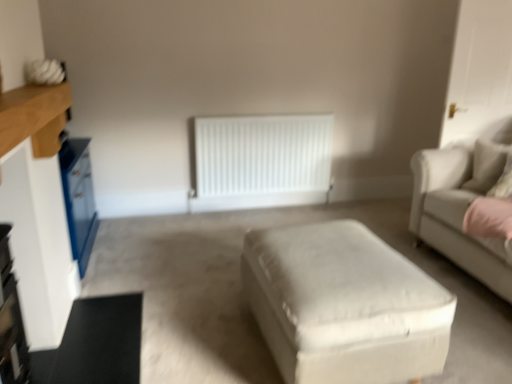
Locate an element on the screen. This screenshot has width=512, height=384. white fabric ottoman at center is located at coordinates 344,305.

What do you see at coordinates (487, 165) in the screenshot? I see `beige fabric pillow at right` at bounding box center [487, 165].

What is the approximate height of beige fabric pillow at right?

The height of beige fabric pillow at right is 20.41 inches.

What is the approximate height of white matte radiator at center?

It is 33.25 inches.

What do you see at coordinates (37, 208) in the screenshot?
I see `white wood entertainment center at left` at bounding box center [37, 208].

This screenshot has width=512, height=384. What are the coordinates of `beige fabric couch at right` in the screenshot? It's located at (462, 204).

In the scene shown: Considering the relative sizes of beige fabric pillow at right and beige fabric couch at right in the image provided, is beige fabric pillow at right bigger than beige fabric couch at right?

Incorrect, beige fabric pillow at right is not larger than beige fabric couch at right.

Which point is more forward, (493, 146) or (464, 145)?

The point (493, 146) is closer to the camera.

From a real-world perspective, is beige fabric pillow at right on beige fabric couch at right?

Yes, from a real-world perspective, beige fabric pillow at right is on top of beige fabric couch at right.

From the image's perspective, would you say beige fabric pillow at right is shown under beige fabric couch at right?

No, from the image's perspective, beige fabric pillow at right is not below beige fabric couch at right.

Which is behind, beige fabric couch at right or white wood entertainment center at left?

Positioned behind is beige fabric couch at right.

Looking at this image, can you confirm if beige fabric couch at right is positioned to the right of white wood entertainment center at left?

Yes.

From the image's perspective, is beige fabric couch at right below white wood entertainment center at left?

Yes, from the image's perspective, beige fabric couch at right is below white wood entertainment center at left.

Are beige fabric couch at right and white wood entertainment center at left far apart?

Yes, beige fabric couch at right is far from white wood entertainment center at left.

Is the surface of beige fabric pillow at right in direct contact with white matte radiator at center?

No, beige fabric pillow at right is not with white matte radiator at center.

Considering the positions of points (480, 157) and (309, 121), is point (480, 157) closer to camera compared to point (309, 121)?

Yes.

Find the location of a particular element. pillow in front of the white matte radiator at center is located at coordinates (487, 165).

Which is more to the left, beige fabric pillow at right or white matte radiator at center?

white matte radiator at center is more to the left.

Does point (474, 183) lie in front of point (205, 125)?

Yes, it is.

From the image's perspective, which object appears higher, beige fabric couch at right or white matte radiator at center?

white matte radiator at center is shown above in the image.

Is beige fabric couch at right looking in the opposite direction of white matte radiator at center?

beige fabric couch at right does not have its back to white matte radiator at center.

Which of these two, beige fabric couch at right or white matte radiator at center, is wider?

Wider between the two is beige fabric couch at right.

Could white fabric ottoman at center be considered to be inside beige fabric couch at right?

No, white fabric ottoman at center is not inside beige fabric couch at right.

Is beige fabric couch at right thinner than white fabric ottoman at center?

No.

Is white fabric ottoman at center at the back of beige fabric couch at right?

No, beige fabric couch at right's orientation is not away from white fabric ottoman at center.

Based on the photo, are beige fabric couch at right and white fabric ottoman at center far apart?

Yes, beige fabric couch at right and white fabric ottoman at center are located far from each other.

Considering the relative sizes of white wood entertainment center at left and beige fabric pillow at right in the image provided, is white wood entertainment center at left smaller than beige fabric pillow at right?

No, white wood entertainment center at left is not smaller than beige fabric pillow at right.

How much distance is there between white wood entertainment center at left and beige fabric pillow at right?

white wood entertainment center at left and beige fabric pillow at right are 2.61 meters apart.

Is white wood entertainment center at left surrounding beige fabric pillow at right?

No, beige fabric pillow at right is located outside of white wood entertainment center at left.

Based on the photo, considering the relative sizes of white matte radiator at center and white wood entertainment center at left in the image provided, is white matte radiator at center bigger than white wood entertainment center at left?

Yes.

From the image's perspective, is white matte radiator at center located above or below white wood entertainment center at left?

From the image's perspective, white matte radiator at center appears above white wood entertainment center at left.

Is white matte radiator at center wider than white wood entertainment center at left?

No.

Measure the distance from white matte radiator at center to white wood entertainment center at left.

white matte radiator at center and white wood entertainment center at left are 5.82 feet apart from each other.

You are a GUI agent. You are given a task and a screenshot of the screen. Output one action in this format:
    pyautogui.click(x=<x>, y=<y>)
    Task: Click on the pillow above the beige fabric couch at right (from the image's perspective)
    The width and height of the screenshot is (512, 384).
    Given the screenshot: What is the action you would take?
    pyautogui.click(x=487, y=165)

Where is `studio couch on the right of white wood entertainment center at left`? The image size is (512, 384). studio couch on the right of white wood entertainment center at left is located at coordinates (462, 204).

In the scene shown: Looking at the image, which one is located further to white matte radiator at center, beige fabric couch at right or beige fabric pillow at right?

Among the two, beige fabric pillow at right is located further to white matte radiator at center.

Considering their positions, is beige fabric couch at right positioned closer to white fabric ottoman at center than beige fabric pillow at right?

The object closer to white fabric ottoman at center is beige fabric couch at right.

Estimate the real-world distances between objects in this image. Which object is closer to beige fabric pillow at right, white matte radiator at center or beige fabric couch at right?

beige fabric couch at right is closer to beige fabric pillow at right.

Estimate the real-world distances between objects in this image. Which object is closer to white fabric ottoman at center, white matte radiator at center or beige fabric couch at right?

Among the two, beige fabric couch at right is located nearer to white fabric ottoman at center.

Estimate the real-world distances between objects in this image. Which object is closer to beige fabric pillow at right, beige fabric couch at right or white wood entertainment center at left?

beige fabric couch at right.

From the image, which object appears to be nearer to beige fabric couch at right, white wood entertainment center at left or beige fabric pillow at right?

beige fabric pillow at right is positioned closer to the anchor beige fabric couch at right.

Looking at the image, which one is located further to beige fabric pillow at right, white wood entertainment center at left or beige fabric couch at right?

The object further to beige fabric pillow at right is white wood entertainment center at left.

Which object lies further to the anchor point white fabric ottoman at center, beige fabric couch at right or white wood entertainment center at left?

white wood entertainment center at left is further to white fabric ottoman at center.

Find the location of `pillow between white fabric ottoman at center and beige fabric couch at right`. pillow between white fabric ottoman at center and beige fabric couch at right is located at coordinates (x=487, y=165).

Where is `pillow located between white wood entertainment center at left and white matte radiator at center in the depth direction`? This screenshot has width=512, height=384. pillow located between white wood entertainment center at left and white matte radiator at center in the depth direction is located at coordinates (487, 165).

At what (x,y) coordinates should I click in order to perform the action: click on pillow situated between white wood entertainment center at left and beige fabric couch at right from left to right. Please return your answer as a coordinate pair (x, y). This screenshot has width=512, height=384. Looking at the image, I should click on (487, 165).

The height and width of the screenshot is (384, 512). Identify the location of studio couch between white wood entertainment center at left and white matte radiator at center in the front-back direction. (462, 204).